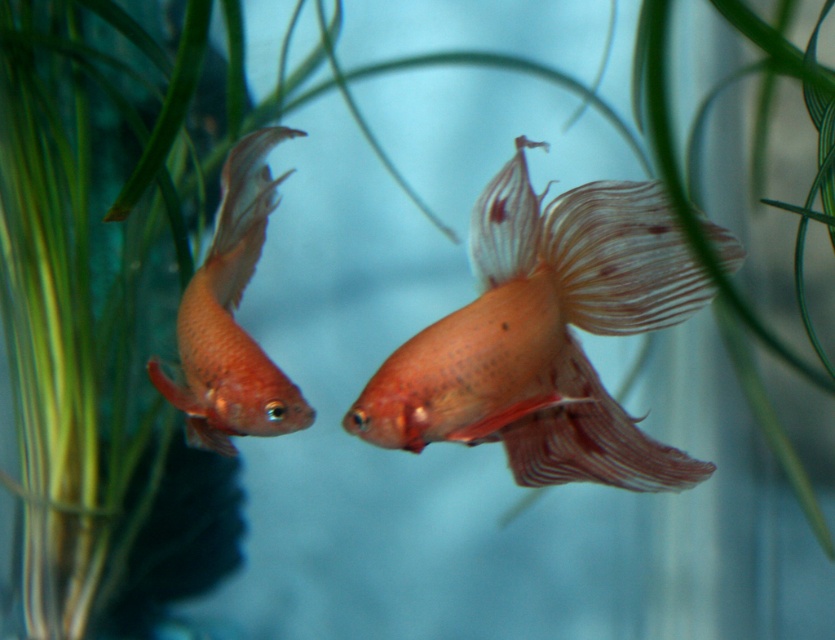
Which is in front, point (552, 307) or point (282, 376)?

Point (552, 307) is more forward.

The width and height of the screenshot is (835, 640). What do you see at coordinates (544, 337) in the screenshot? I see `translucent orange fish at center` at bounding box center [544, 337].

You are a GUI agent. You are given a task and a screenshot of the screen. Output one action in this format:
    pyautogui.click(x=<x>, y=<y>)
    Task: Click on the translucent orange fish at center
    The height and width of the screenshot is (640, 835).
    Given the screenshot: What is the action you would take?
    pyautogui.click(x=544, y=337)